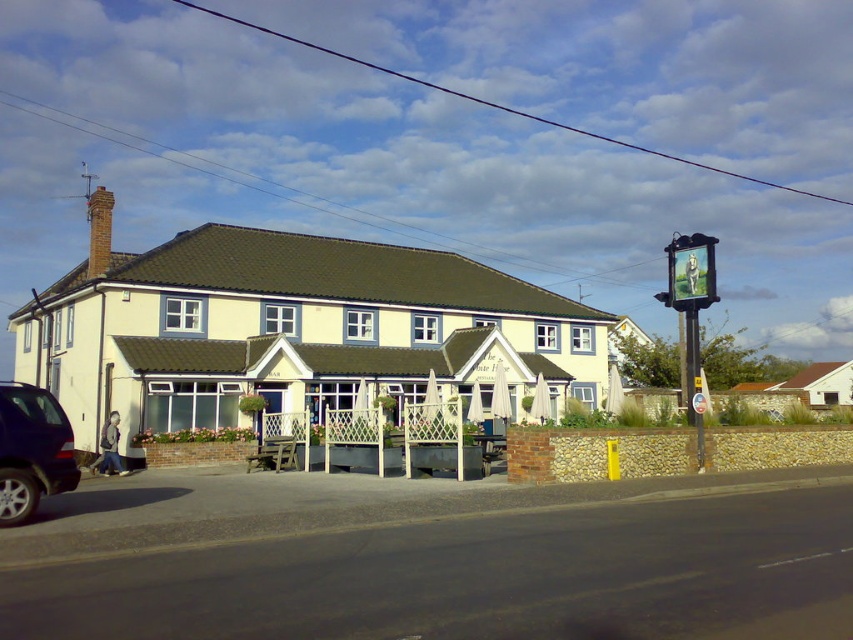
Question: Is matte black suv at lower left closer to camera compared to metallic signboard at upper right?

Choices:
 (A) no
 (B) yes

Answer: (B)

Question: Is matte black suv at lower left to the right of metallic signboard at upper right from the viewer's perspective?

Choices:
 (A) yes
 (B) no

Answer: (B)

Question: Is matte black suv at lower left positioned before metallic signboard at upper right?

Choices:
 (A) no
 (B) yes

Answer: (B)

Question: Which point is farther to the camera?

Choices:
 (A) pos(74,467)
 (B) pos(674,275)

Answer: (B)

Question: Among these objects, which one is farthest from the camera?

Choices:
 (A) matte black suv at lower left
 (B) metallic signboard at upper right

Answer: (B)

Question: Which point is closer to the camera?

Choices:
 (A) metallic signboard at upper right
 (B) matte black suv at lower left

Answer: (B)